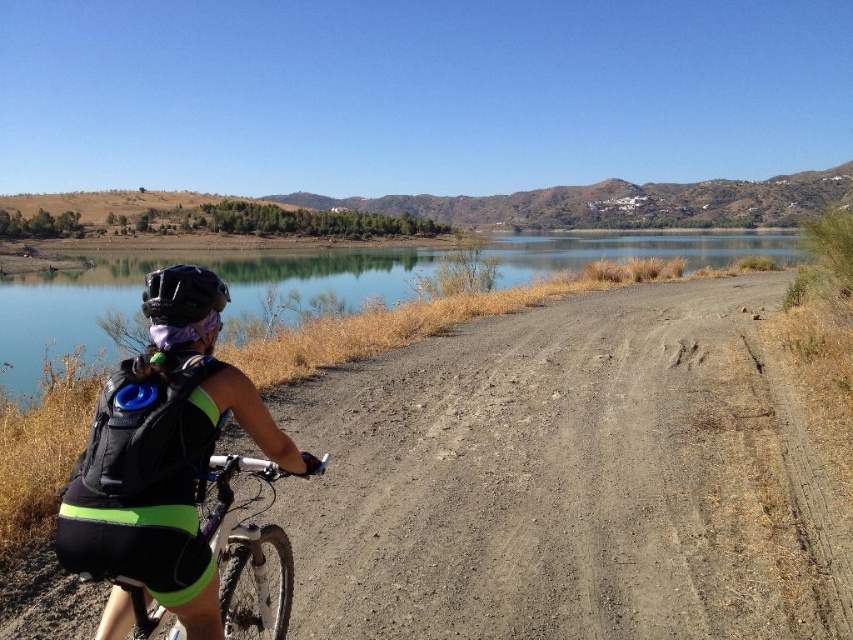
Question: Which object appears farthest from the camera in this image?

Choices:
 (A) clear blue water at center
 (B) dirt/gravel road at center
 (C) black matte bicycle at left
 (D) silver metallic bicycle at center-left

Answer: (A)

Question: Which of the following is the farthest from the observer?

Choices:
 (A) (259, 545)
 (B) (683, 342)
 (C) (107, 458)
 (D) (170, 272)

Answer: (B)

Question: Does black matte bicycle at left have a greater width compared to silver metallic bicycle at center-left?

Choices:
 (A) yes
 (B) no

Answer: (A)

Question: Is dirt/gravel road at center wider than black matte bicycle at left?

Choices:
 (A) no
 (B) yes

Answer: (B)

Question: Can you confirm if black matte bicycle at left is positioned to the left of clear blue water at center?

Choices:
 (A) no
 (B) yes

Answer: (B)

Question: Which point appears closest to the camera in this image?

Choices:
 (A) (26, 285)
 (B) (718, 420)
 (C) (97, 506)

Answer: (C)